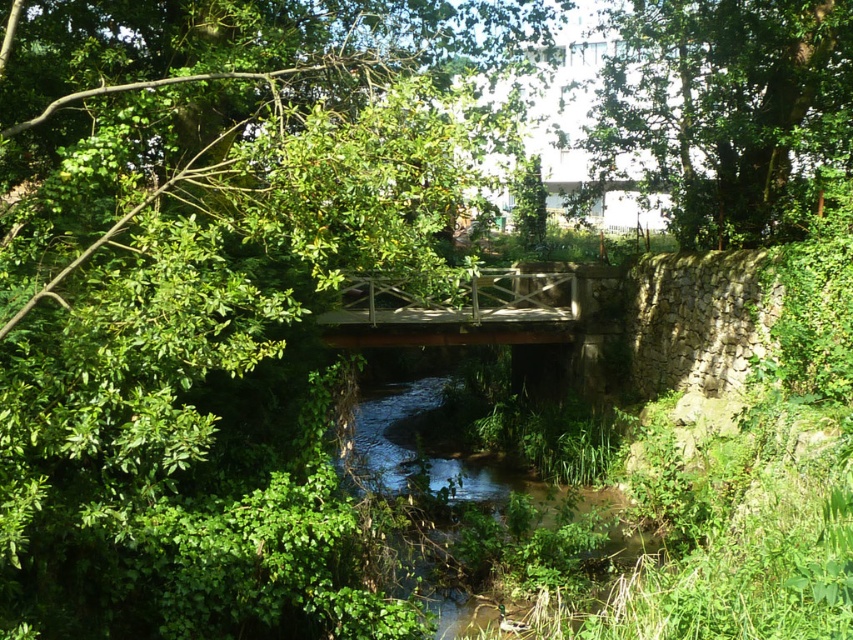
You are a hiker who wants to take a photo of the green leafy tree at center and the green leafy tree at upper center. Which tree should you move closer to in order to capture both trees in the same frame without zooming in?

You should move closer to the green leafy tree at center because it is wider than the green leafy tree at upper center, allowing both to fit in the frame when positioned closer to the wider tree.

Based on the photo, you are standing at the point labeled as point (730, 109) in the scene. Looking around, you see a small wooden bridge crossing a stream and a green leafy tree. Which direction should you walk to reach the green leafy tree at upper center?

The point labeled as point (730, 109) corresponds to the green leafy tree at upper center, so you are already at the location of the green leafy tree at upper center. Therefore, you don not need to walk anywhere else to reach it.

You are a hiker standing on the wooden bridge and looking towards the green leafy tree at center and the green leafy tree at upper center. Which tree appears taller from your position?

The green leafy tree at center appears taller than the green leafy tree at upper center because it is taller in reality.